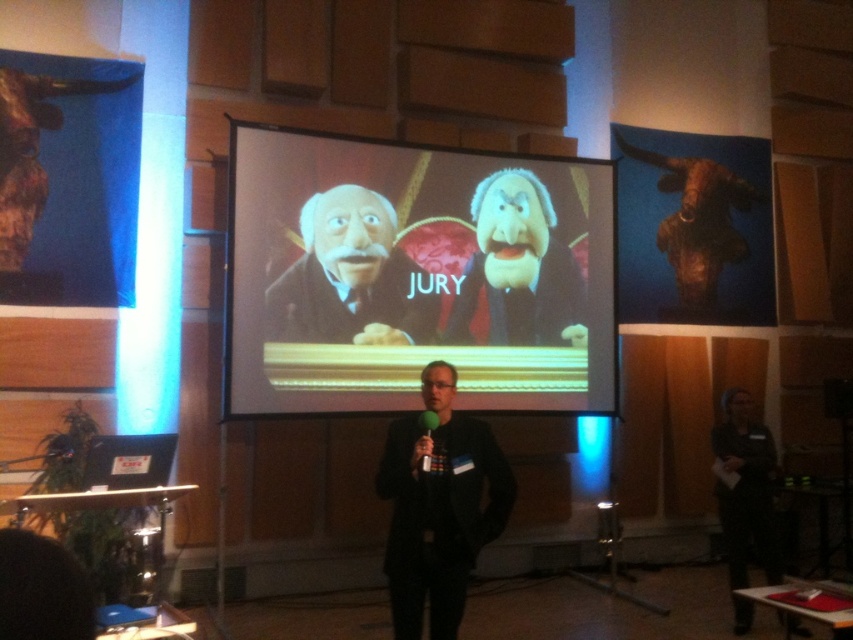
Who is higher up, matte black screen at center or dark gray suit at lower right?

Positioned higher is matte black screen at center.

Can you confirm if matte black screen at center is taller than dark gray suit at lower right?

Correct, matte black screen at center is much taller as dark gray suit at lower right.

Does point (461, 385) lie in front of point (744, 618)?

No, (461, 385) is behind (744, 618).

Locate an element on the screen. matte black screen at center is located at coordinates (415, 276).

Can you confirm if matte black screen at center is positioned to the left of black matte suit at center?

Yes, matte black screen at center is to the left of black matte suit at center.

Is matte black screen at center bigger than black matte suit at center?

Indeed, matte black screen at center has a larger size compared to black matte suit at center.

Between point (523, 264) and point (444, 400), which one is positioned in front?

Point (444, 400) is more forward.

Locate an element on the screen. matte black screen at center is located at coordinates pyautogui.click(x=415, y=276).

Can you confirm if matte black screen at center is taller than smooth puppet at center?

Indeed, matte black screen at center has a greater height compared to smooth puppet at center.

Where is `matte black screen at center`? This screenshot has height=640, width=853. matte black screen at center is located at coordinates (415, 276).